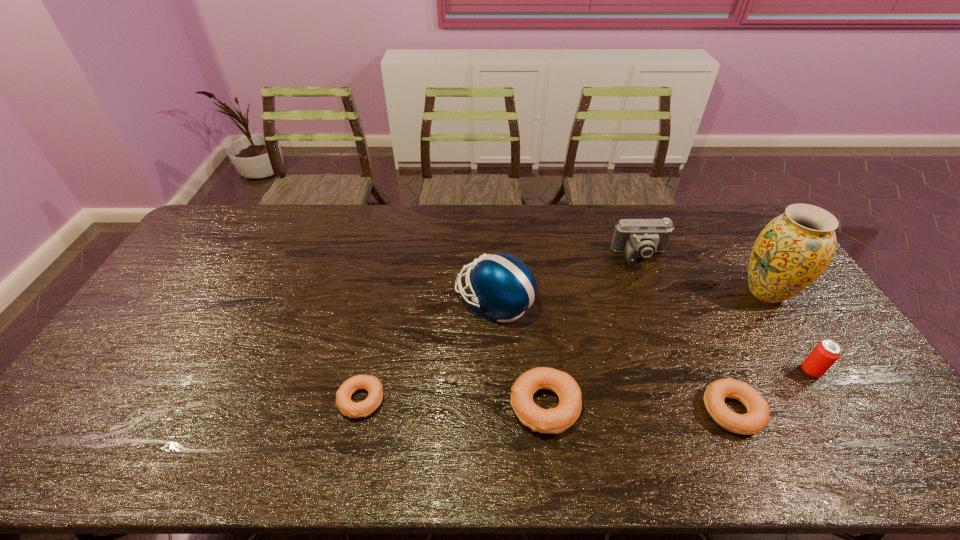
Please point a spot to add another bagel on the left. Please provide its 2D coordinates. Your answer should be formatted as a tuple, i.e. [(x, y)], where the tuple contains the x and y coordinates of a point satisfying the conditions above.

[(180, 395)]